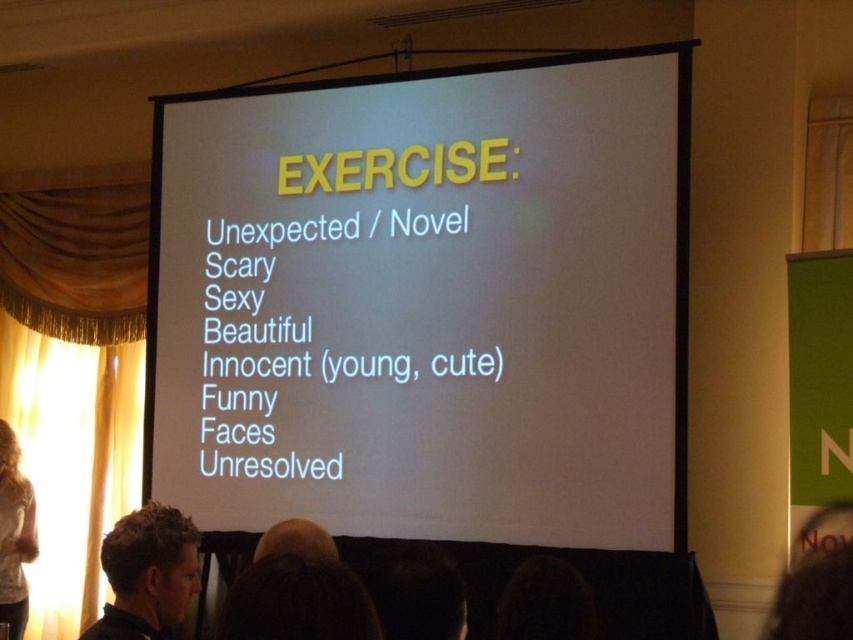
Does white matte projection screen at center have a lesser height compared to brown hair at center?

Incorrect, white matte projection screen at center's height does not fall short of brown hair at center's.

Can you confirm if white matte projection screen at center is positioned to the left of brown hair at center?

In fact, white matte projection screen at center is to the right of brown hair at center.

Is point (251, 282) behind point (335, 556)?

Yes, point (251, 282) is farther from viewer.

Where is `white matte projection screen at center`? The image size is (853, 640). white matte projection screen at center is located at coordinates (426, 304).

Who is lower down, white matte projection screen at center or light brown hair at left?

light brown hair at left is below.

Is point (579, 307) in front of point (1, 609)?

That is True.

Which is in front, point (468, 356) or point (16, 589)?

Point (468, 356) is in front.

Locate an element on the screen. The height and width of the screenshot is (640, 853). white matte projection screen at center is located at coordinates (426, 304).

Between white matte projection screen at center and dark brown hair at lower left, which one has less height?

dark brown hair at lower left

Measure the distance from white matte projection screen at center to dark brown hair at lower left.

They are 2.03 meters apart.

Is point (625, 83) closer to camera compared to point (160, 525)?

No, it is behind (160, 525).

The width and height of the screenshot is (853, 640). I want to click on white matte projection screen at center, so click(x=426, y=304).